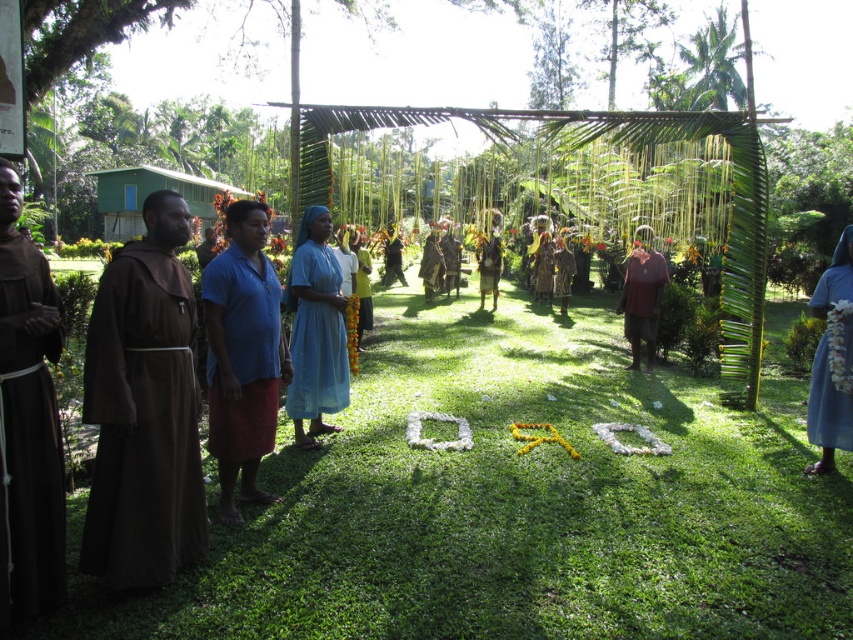
Does blue fabric at center have a greater height compared to textured brown skirt at center?

No, blue fabric at center is not taller than textured brown skirt at center.

Which is in front, point (833, 362) or point (527, 250)?

Point (833, 362) is more forward.

Locate an element on the screen. This screenshot has width=853, height=640. blue fabric at center is located at coordinates (833, 358).

Can you confirm if green grass at center is shorter than brown woolen robe at left?

Yes, green grass at center is shorter than brown woolen robe at left.

Who is higher up, green grass at center or brown woolen robe at left?

brown woolen robe at left

Describe the element at coordinates (514, 504) in the screenshot. The width and height of the screenshot is (853, 640). I see `green grass at center` at that location.

This screenshot has height=640, width=853. I want to click on green grass at center, so click(514, 504).

Does brown cloth at left appear over brown fabric robe at center?

Actually, brown cloth at left is below brown fabric robe at center.

Which is above, brown cloth at left or brown fabric robe at center?

brown fabric robe at center is higher up.

Describe the element at coordinates (32, 428) in the screenshot. I see `brown cloth at left` at that location.

The width and height of the screenshot is (853, 640). In order to click on brown cloth at left in this screenshot , I will do `click(32, 428)`.